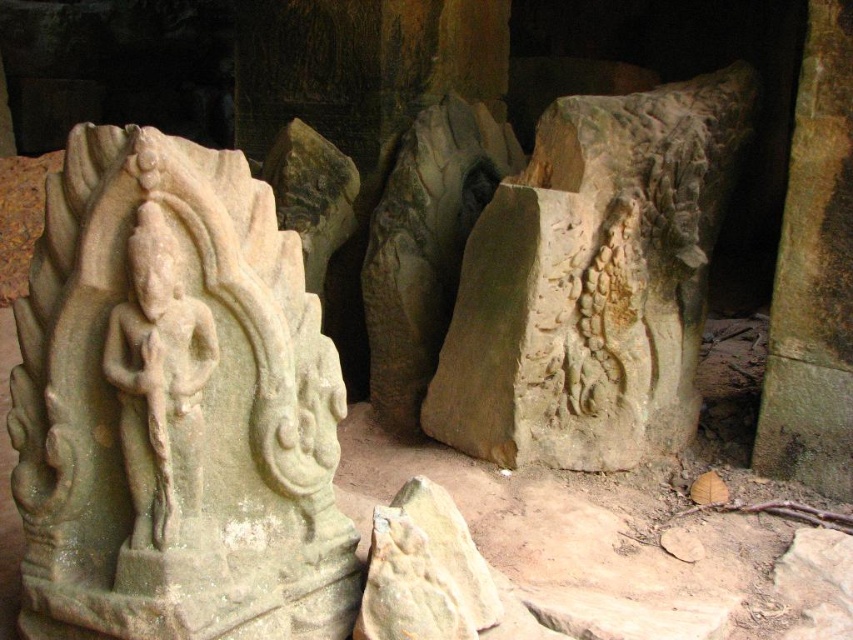
Is gray stone statue at center bigger than white stone deity at left?

Yes, gray stone statue at center is bigger than white stone deity at left.

Between gray stone statue at center and white stone deity at left, which one appears on the right side from the viewer's perspective?

From the viewer's perspective, white stone deity at left appears more on the right side.

Does point (260, 305) come in front of point (141, 486)?

That is False.

At what (x,y) coordinates should I click in order to perform the action: click on gray stone statue at center. Please return your answer as a coordinate pair (x, y). Image resolution: width=853 pixels, height=640 pixels. Looking at the image, I should click on (173, 406).

How much distance is there between gray stone statue at center and gray stone carving at center?

gray stone statue at center is 3.81 feet away from gray stone carving at center.

Is gray stone statue at center bigger than gray stone carving at center?

No.

What do you see at coordinates (173, 406) in the screenshot? I see `gray stone statue at center` at bounding box center [173, 406].

The image size is (853, 640). I want to click on gray stone statue at center, so click(173, 406).

Which is in front, point (663, 186) or point (178, 442)?

Point (178, 442) is in front.

Can you confirm if gray stone carving at center is bigger than white stone deity at left?

Yes.

Identify the location of gray stone carving at center. (593, 282).

The width and height of the screenshot is (853, 640). I want to click on gray stone carving at center, so click(x=593, y=282).